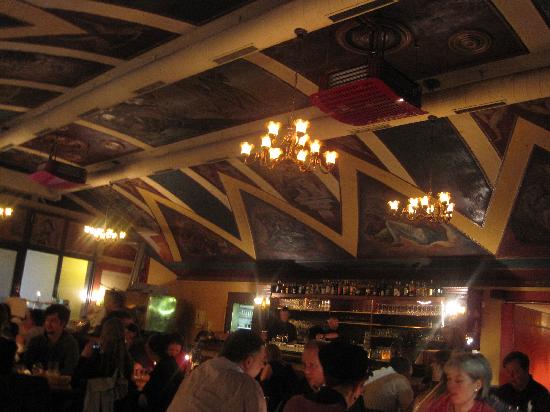
This screenshot has width=550, height=412. Identify the location of counter. (291, 350).